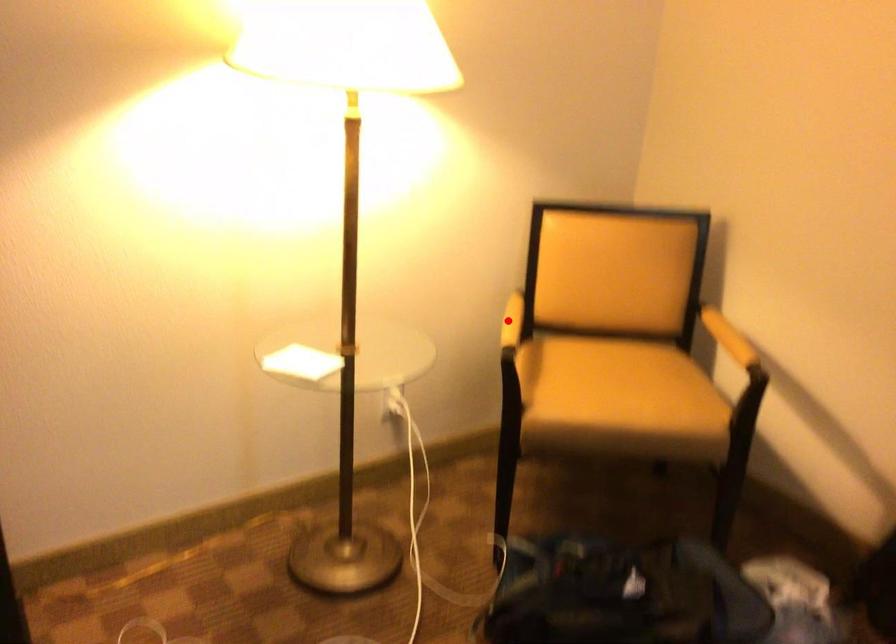
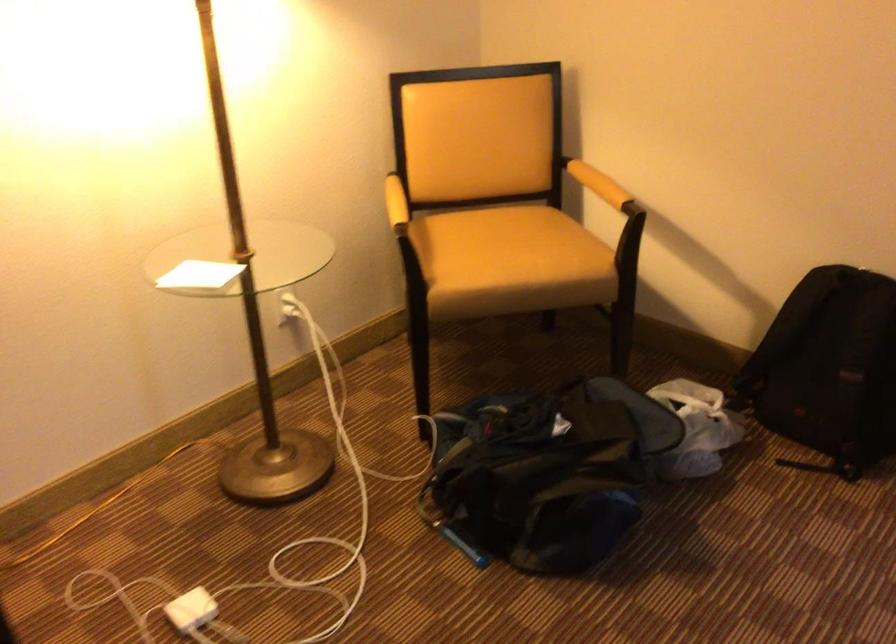
In the second image, find the point that corresponds to the highlighted location in the first image.

(395, 203)